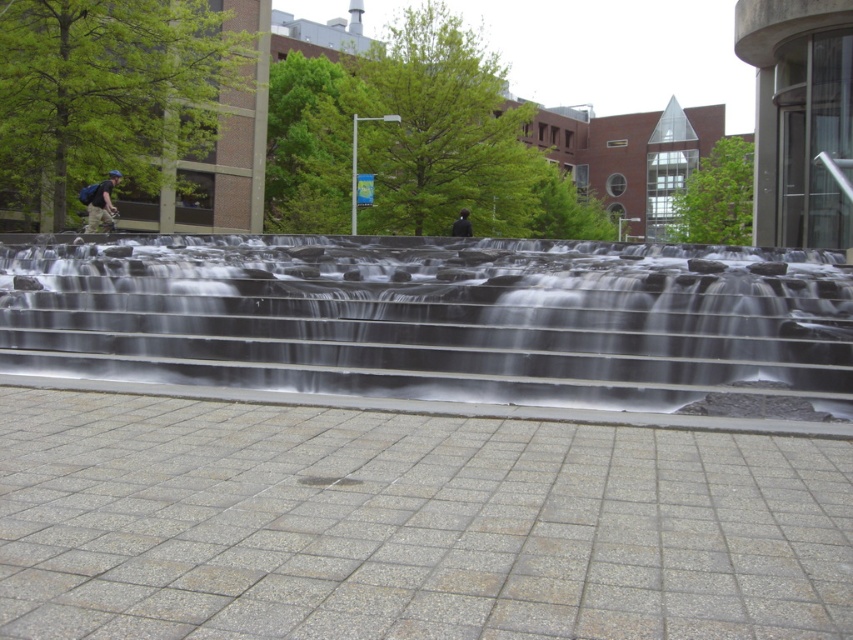
Is point (0, 282) positioned behind point (457, 230)?

No, it is in front of (457, 230).

Between point (643, 410) and point (469, 225), which one is positioned behind?

The point (469, 225) is behind.

Does point (518, 305) come in front of point (463, 209)?

Yes, it is.

Where is `clear glass water at center`? clear glass water at center is located at coordinates (439, 317).

Can you confirm if clear glass water at center is smaller than matte black backpack at left?

No, clear glass water at center is not smaller than matte black backpack at left.

Is clear glass water at center taller than matte black backpack at left?

Indeed, clear glass water at center has a greater height compared to matte black backpack at left.

You are a GUI agent. You are given a task and a screenshot of the screen. Output one action in this format:
    pyautogui.click(x=<x>, y=<y>)
    Task: Click on the clear glass water at center
    
    Given the screenshot: What is the action you would take?
    pyautogui.click(x=439, y=317)

Which is more to the left, matte black backpack at left or dark blue fabric jacket at center?

From the viewer's perspective, matte black backpack at left appears more on the left side.

Between matte black backpack at left and dark blue fabric jacket at center, which one is positioned lower?

Positioned lower is matte black backpack at left.

Measure the distance between matte black backpack at left and camera.

A distance of 17.10 meters exists between matte black backpack at left and camera.

You are a GUI agent. You are given a task and a screenshot of the screen. Output one action in this format:
    pyautogui.click(x=<x>, y=<y>)
    Task: Click on the matte black backpack at left
    
    Given the screenshot: What is the action you would take?
    [x=102, y=204]